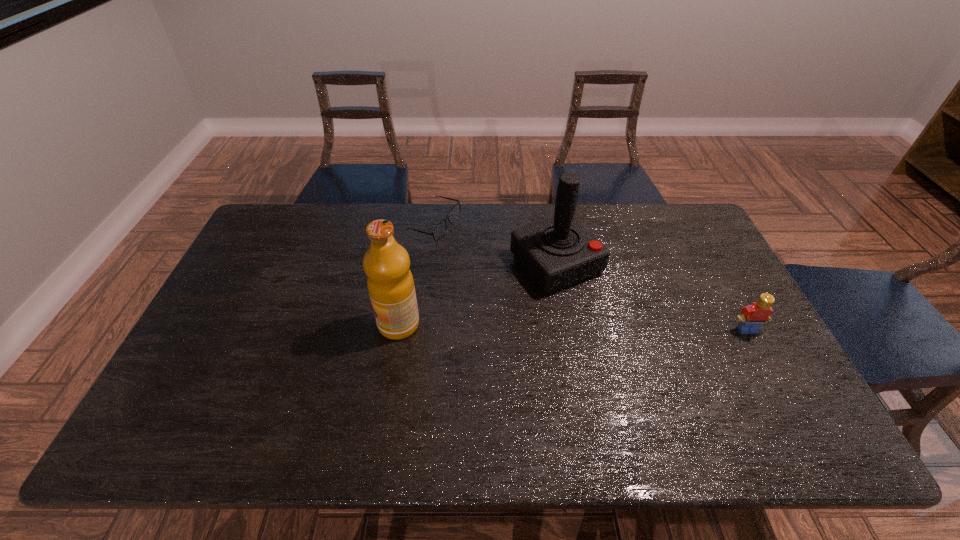
Find the location of a particular element. vacant space on the desktop that is between the fruit juice and the third tallest object and is positioned with the lenses facing outward on the spectacles is located at coordinates (532, 327).

You are a GUI agent. You are given a task and a screenshot of the screen. Output one action in this format:
    pyautogui.click(x=<x>, y=<y>)
    Task: Click on the vacant space on the desktop that is between the fruit juice and the rightmost object and is positioned on the base of the joystick
    
    Given the screenshot: What is the action you would take?
    pyautogui.click(x=614, y=328)